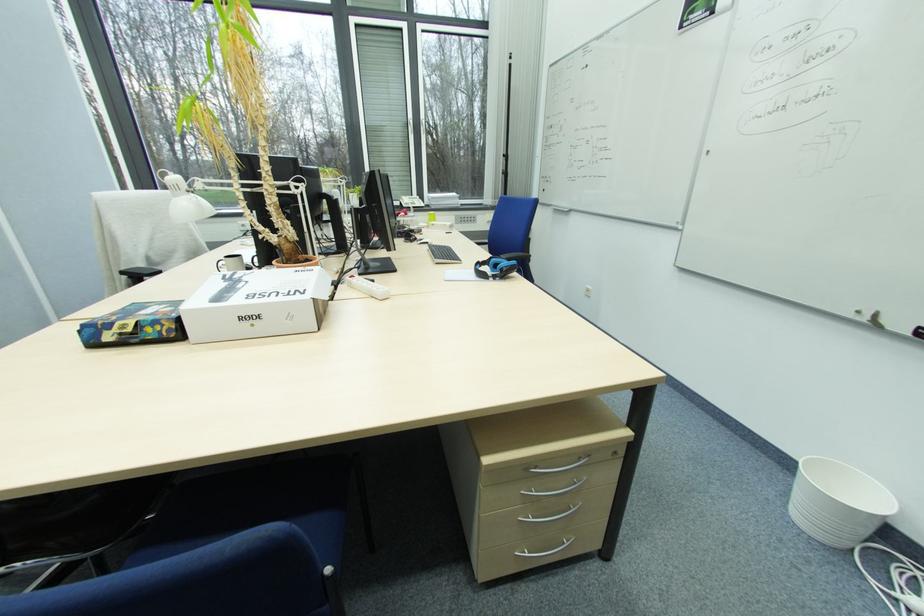
You are a GUI agent. You are given a task and a screenshot of the screen. Output one action in this format:
    pyautogui.click(x=<x>, y=<y>)
    Task: Click on the colorful patterned box
    
    Given the screenshot: What is the action you would take?
    pyautogui.click(x=134, y=325)